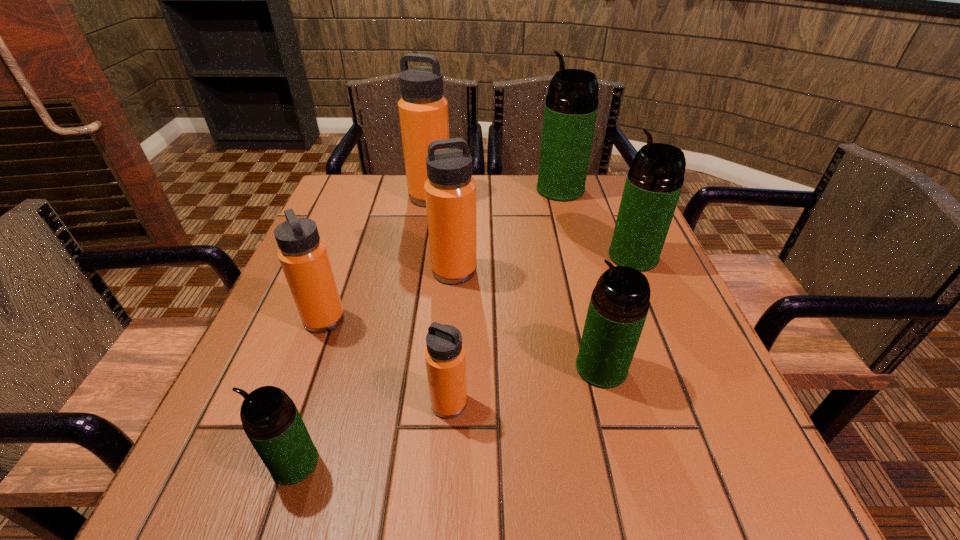
Find the location of `vacant region between the biggest green thermos bottle and the second farthest green thermos bottle`. vacant region between the biggest green thermos bottle and the second farthest green thermos bottle is located at coordinates (597, 223).

You are a GUI agent. You are given a task and a screenshot of the screen. Output one action in this format:
    pyautogui.click(x=<x>, y=<y>)
    Task: Click on the unoccupied area between the leftmost orange thermos bottle and the second farthest orange thermos bottle
    This screenshot has height=540, width=960.
    Given the screenshot: What is the action you would take?
    pyautogui.click(x=389, y=295)

Locate an element on the screen. The width and height of the screenshot is (960, 540). unoccupied area between the second smallest green thermos bottle and the second farthest orange thermos bottle is located at coordinates (528, 319).

You are a GUI agent. You are given a task and a screenshot of the screen. Output one action in this format:
    pyautogui.click(x=<x>, y=<y>)
    Task: Click on the vacant area that lies between the third nearest orange thermos bottle and the second nearest green thermos bottle
    The image size is (960, 540).
    Given the screenshot: What is the action you would take?
    pyautogui.click(x=528, y=319)

At what (x,y) coordinates should I click in order to perform the action: click on free space between the smallest orange thermos bottle and the second farthest green thermos bottle. Please return your answer as a coordinate pair (x, y). Image resolution: width=960 pixels, height=540 pixels. Looking at the image, I should click on (541, 330).

Locate which object ranks second in proximity to the leftmost orange thermos bottle. Please provide its 2D coordinates. Your answer should be formatted as a tuple, i.e. [(x, y)], where the tuple contains the x and y coordinates of a point satisfying the conditions above.

[(270, 419)]

Where is `object that is the second closest one to the second smallest green thermos bottle`? This screenshot has width=960, height=540. object that is the second closest one to the second smallest green thermos bottle is located at coordinates (655, 179).

Select which thermos bottle is the fourth closest to the smallest orange thermos bottle. Please provide its 2D coordinates. Your answer should be formatted as a tuple, i.e. [(x, y)], where the tuple contains the x and y coordinates of a point satisfying the conditions above.

[(450, 191)]

Where is `thermos bottle object that ranks as the fifth closest to the biggest green thermos bottle`? The image size is (960, 540). thermos bottle object that ranks as the fifth closest to the biggest green thermos bottle is located at coordinates (303, 256).

Identify the location of orange thermos bottle that can be found as the closest to the nearest green thermos bottle. This screenshot has width=960, height=540. (445, 357).